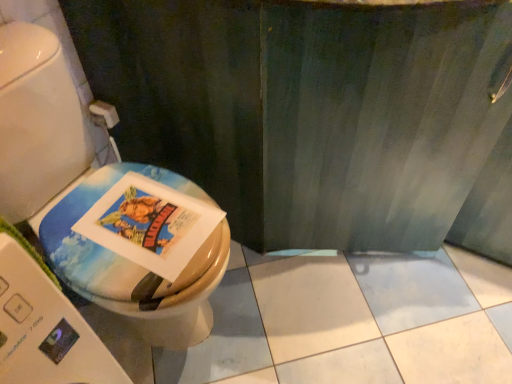
Question: Does matte plastic toilet at left have a lesser height compared to white matte toilet paper at upper left?

Choices:
 (A) no
 (B) yes

Answer: (A)

Question: Is matte plastic toilet at left not inside white matte toilet paper at upper left?

Choices:
 (A) yes
 (B) no

Answer: (A)

Question: From a real-world perspective, is matte plastic toilet at left positioned under white matte toilet paper at upper left based on gravity?

Choices:
 (A) no
 (B) yes

Answer: (A)

Question: Is matte plastic toilet at left at the right side of white matte toilet paper at upper left?

Choices:
 (A) yes
 (B) no

Answer: (A)

Question: From the image's perspective, is matte plastic toilet at left above white matte toilet paper at upper left?

Choices:
 (A) no
 (B) yes

Answer: (A)

Question: Could white matte toilet paper at upper left be considered to be inside matte plastic toilet at left?

Choices:
 (A) no
 (B) yes

Answer: (A)

Question: Is matte plastic toilet at left positioned with its back to matte paper comic book at center?

Choices:
 (A) yes
 (B) no

Answer: (A)

Question: Is matte plastic toilet at left facing towards matte paper comic book at center?

Choices:
 (A) yes
 (B) no

Answer: (A)

Question: Is matte plastic toilet at left further to camera compared to matte paper comic book at center?

Choices:
 (A) yes
 (B) no

Answer: (B)

Question: From the image's perspective, is matte plastic toilet at left over matte paper comic book at center?

Choices:
 (A) yes
 (B) no

Answer: (A)

Question: Is the surface of matte plastic toilet at left in direct contact with matte paper comic book at center?

Choices:
 (A) no
 (B) yes

Answer: (B)

Question: Does matte plastic toilet at left have a greater width compared to matte paper comic book at center?

Choices:
 (A) yes
 (B) no

Answer: (A)

Question: Is matte plastic toilet at left surrounded by white matte toilet paper at upper left?

Choices:
 (A) no
 (B) yes

Answer: (A)